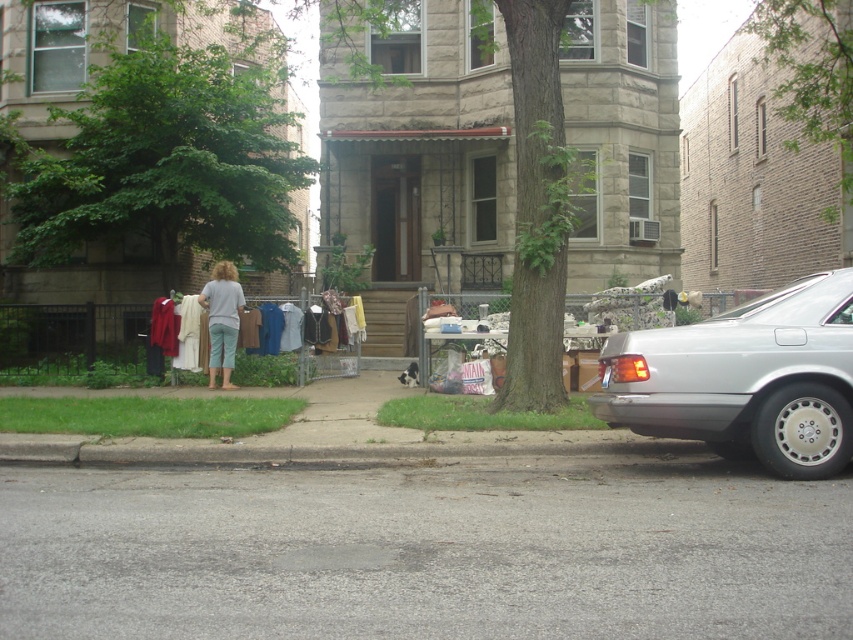
You are a delivery person standing at the camera position. You need to cross the road to reach the sidewalk where the woman is selling clothes. The road is 25 feet wide. Can you safely cross the road without needing to go around the silver metallic car at right?

The distance between the silver metallic car at right and the camera is 28.07 feet. Since the road is 25 feet wide, the car is positioned such that there is enough space to cross the road safely without needing to go around it.

You are a delivery person needing to place a package on the sidewalk. The package is 1 meter wide. Considering the space between the green leafy tree at upper right and the light blue denim shorts at center, will it fit?

The green leafy tree at upper right is wider than the light blue denim shorts at center. However, the description does not provide specific measurements of the distance between them. Therefore, it is uncertain if the 1 meter wide package will fit in that space.

You are a pedestrian standing on the sidewalk and want to buy the light blue denim shorts at center. The seller is under the green leafy tree at upper right. Can you reach the shorts without walking under the tree?

The green leafy tree at upper right is positioned over light blue denim shorts at center, so you would need to walk under the tree to reach the shorts.